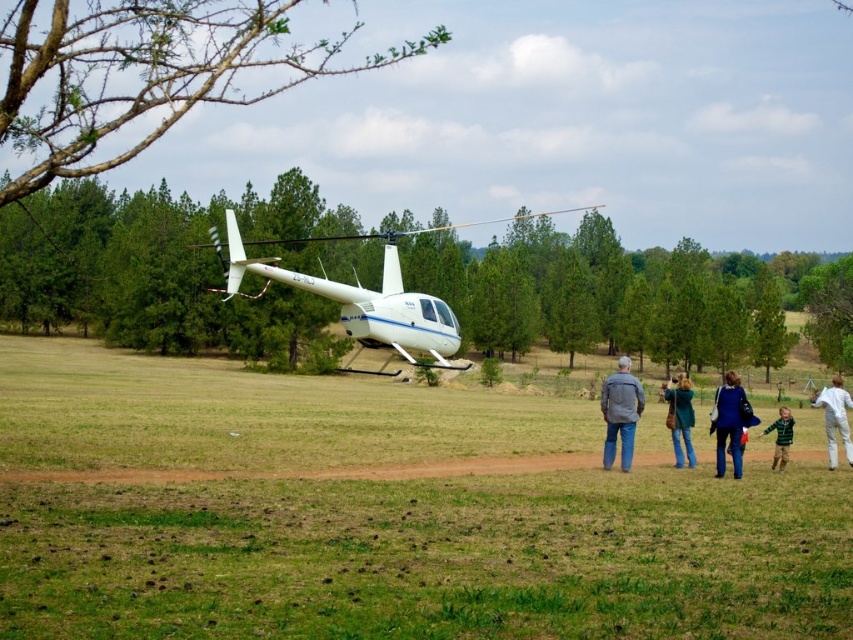
Consider the image. Is the position of blue denim jeans at center less distant than that of white cotton pants at lower right?

Yes, blue denim jeans at center is in front of white cotton pants at lower right.

Who is lower down, blue denim jeans at center or white cotton pants at lower right?

Positioned lower is white cotton pants at lower right.

Is point (732, 451) positioned behind point (849, 456)?

No, it is not.

The image size is (853, 640). I want to click on blue denim jeans at center, so pos(729,420).

Does green grass at center appear over white glossy helicopter at center?

No, green grass at center is not above white glossy helicopter at center.

Can you confirm if green grass at center is positioned below white glossy helicopter at center?

Correct, green grass at center is located below white glossy helicopter at center.

Image resolution: width=853 pixels, height=640 pixels. Identify the location of green grass at center. (437, 554).

The image size is (853, 640). I want to click on green grass at center, so click(437, 554).

Measure the distance from green grass at center to blue denim jeans at center.

green grass at center and blue denim jeans at center are 15.24 meters apart.

Describe the element at coordinates (437, 554) in the screenshot. Image resolution: width=853 pixels, height=640 pixels. I see `green grass at center` at that location.

Which is behind, point (134, 369) or point (747, 412)?

Positioned behind is point (134, 369).

You are a GUI agent. You are given a task and a screenshot of the screen. Output one action in this format:
    pyautogui.click(x=<x>, y=<y>)
    Task: Click on the green grass at center
    The image size is (853, 640).
    Given the screenshot: What is the action you would take?
    pyautogui.click(x=437, y=554)